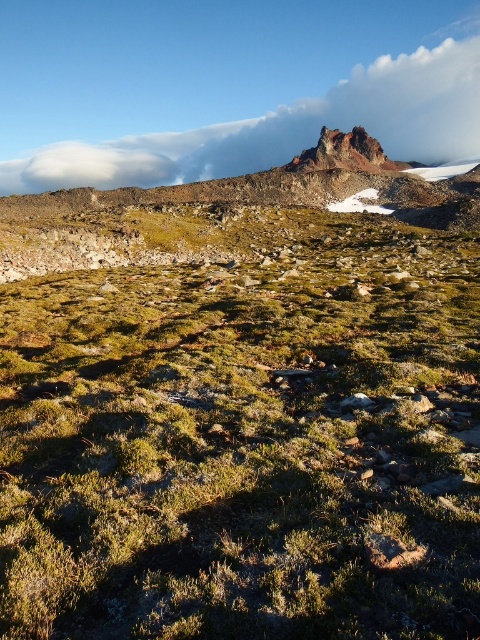
Who is more forward, (414, 72) or (357, 134)?

Point (357, 134) is more forward.

Does white fluffy cloud at upper center appear under rugged rock peak at upper center?

No.

Does point (430, 129) lie behind point (386, 160)?

That is True.

Locate an element on the screen. Image resolution: width=480 pixels, height=640 pixels. white fluffy cloud at upper center is located at coordinates (286, 129).